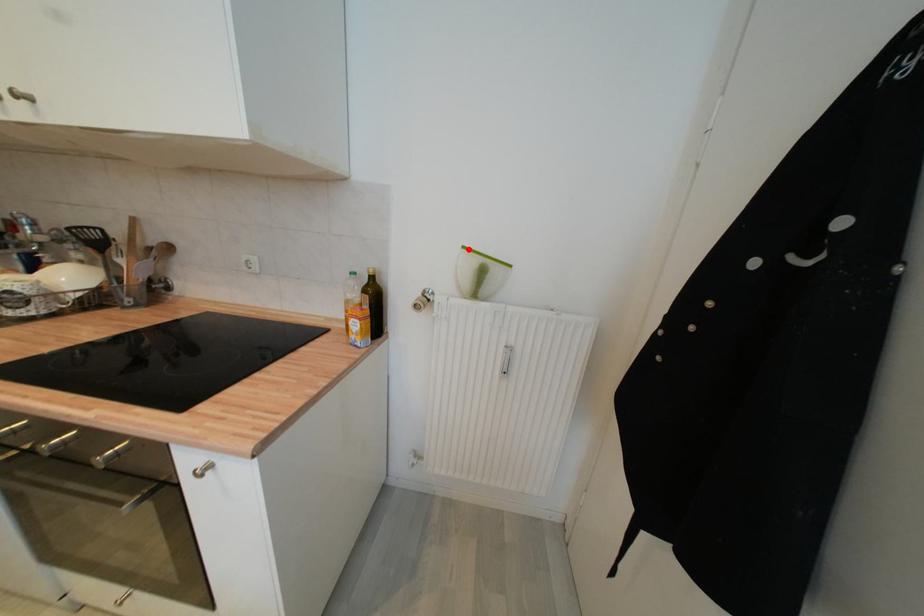
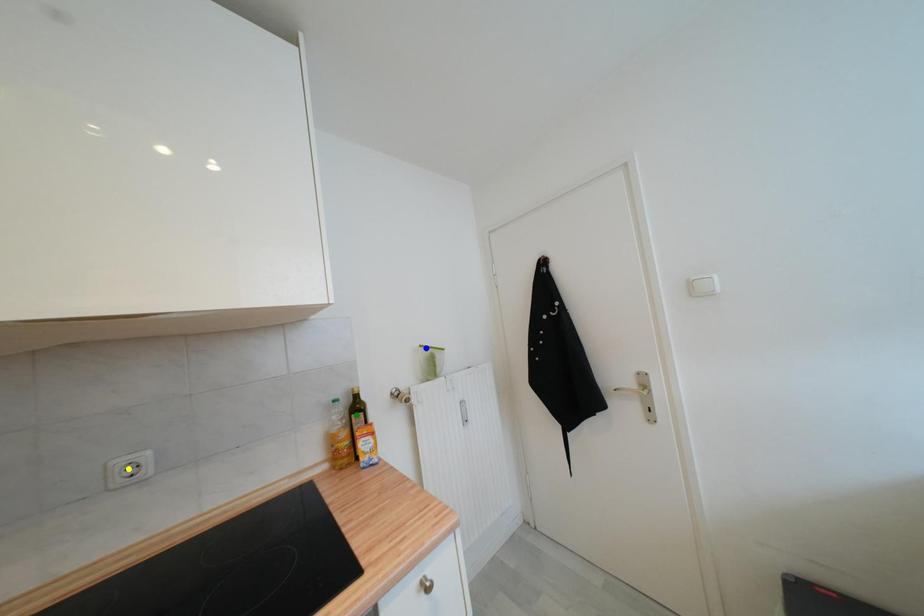
Question: I am providing you with two images of the same scene from different viewpoints. A red point is marked on the first image. You are given multiple points on the second image. Which point in image 2 is actually the same real-world point as the red point in image 1?

Choices:
 (A) green point
 (B) blue point
 (C) yellow point

Answer: (B)